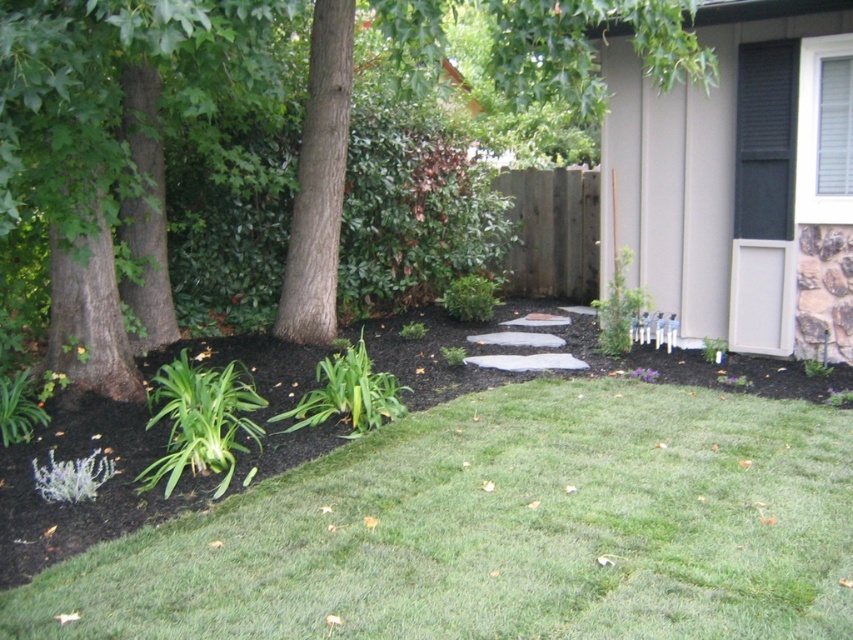
Question: Does green soft grass at lower center have a smaller size compared to brown textured tree at center?

Choices:
 (A) no
 (B) yes

Answer: (B)

Question: Is green soft grass at lower center behind green leafy plant at center?

Choices:
 (A) no
 (B) yes

Answer: (A)

Question: Which point appears farthest from the camera in this image?

Choices:
 (A) (605, 1)
 (B) (320, 390)

Answer: (B)

Question: Which point is farther to the camera?

Choices:
 (A) (351, 378)
 (B) (155, 476)
 (C) (51, 365)
 (D) (625, 384)

Answer: (D)

Question: Which is nearer to the green leafy plant at lower left?

Choices:
 (A) green leafy plant at center
 (B) brown textured tree at center

Answer: (A)

Question: Does green soft grass at lower center have a greater width compared to brown textured tree at center?

Choices:
 (A) no
 (B) yes

Answer: (B)